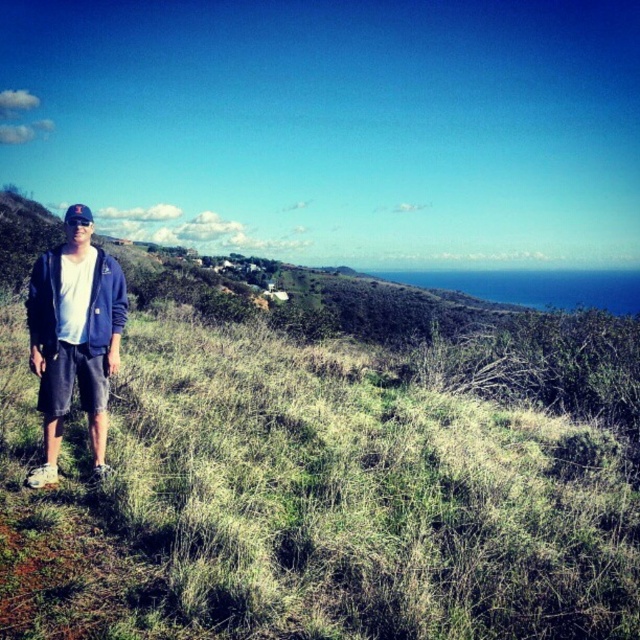
You are standing at the point marked as point (38, 513) on the map. You want to reach the ocean visible in the distance. Considering the slope of the terrain and the distance, how many minutes would it take to walk there at a moderate pace?

The distance between the point (38, 513) and the ocean is 16.58 feet. At a moderate walking pace of about 3 feet per second, it would take approximately 5.5 seconds, which is roughly less than a minute to reach the ocean.

You are a photographer trying to capture the perfect shot of the matte blue jacket at left and the green grassy at center. To ensure both elements are in frame, which direction should you move your camera relative to your current position?

Since the green grassy at center is to the right of the matte blue jacket at left, you should move your camera to the left to include both the matte blue jacket at left and the green grassy at center in the frame.